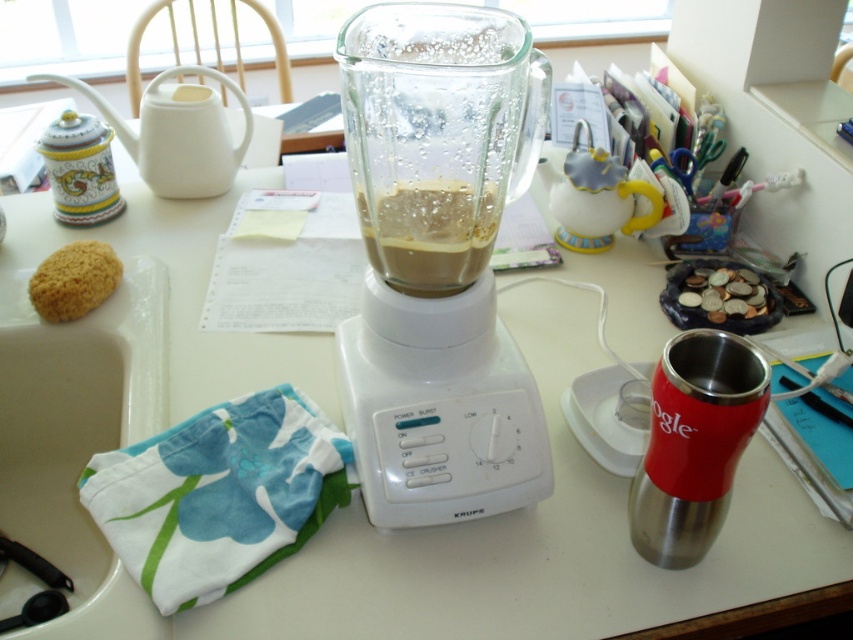
Between stainless steel thermos at right and brown matte liquid at center, which one has less height?

With less height is brown matte liquid at center.

What do you see at coordinates (694, 444) in the screenshot? The height and width of the screenshot is (640, 853). I see `stainless steel thermos at right` at bounding box center [694, 444].

You are a GUI agent. You are given a task and a screenshot of the screen. Output one action in this format:
    pyautogui.click(x=<x>, y=<y>)
    Task: Click on the stainless steel thermos at right
    
    Given the screenshot: What is the action you would take?
    pyautogui.click(x=694, y=444)

Measure the distance between point (525, 93) and camera.

Point (525, 93) and camera are 21.47 inches apart.

The width and height of the screenshot is (853, 640). What do you see at coordinates (438, 260) in the screenshot? I see `white plastic blender at center` at bounding box center [438, 260].

This screenshot has width=853, height=640. What are the coordinates of `white plastic blender at center` in the screenshot? It's located at (438, 260).

Is brown matte liquid at center above yellow sponge at left?

Yes.

Does brown matte liquid at center have a lesser height compared to yellow sponge at left?

Correct, brown matte liquid at center is not as tall as yellow sponge at left.

In order to click on brown matte liquid at center in this screenshot , I will do `click(428, 234)`.